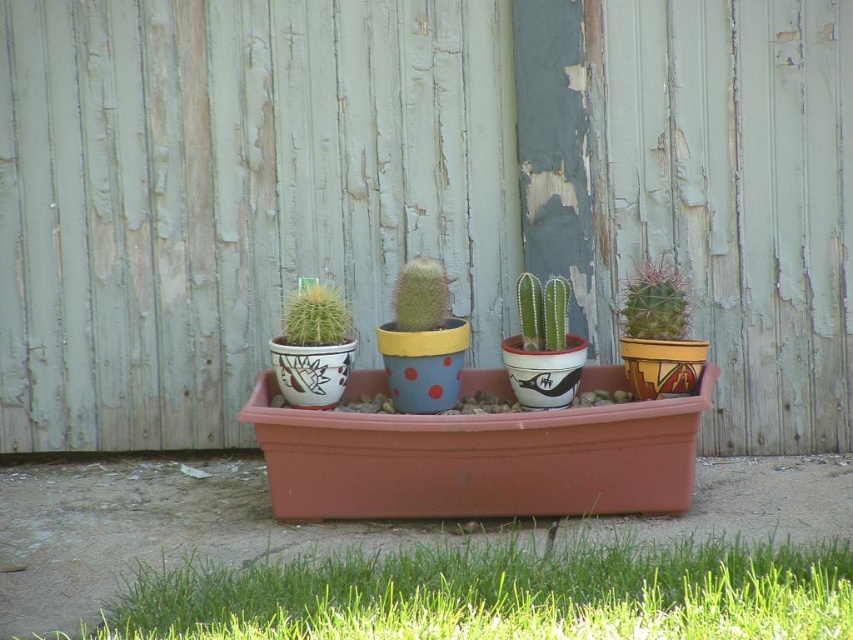
Which is behind, point (219, 630) or point (532, 282)?

Point (532, 282)

This screenshot has width=853, height=640. I want to click on green matte cactus at lower center, so click(498, 593).

Between sandy brown textured cactus at center and matte ceramic cactus at center, which one has more height?

sandy brown textured cactus at center is taller.

Does point (674, 296) come in front of point (325, 284)?

Yes, point (674, 296) is closer to viewer.

Who is more forward, (624,285) or (350,332)?

Positioned in front is point (350,332).

Identify the location of sandy brown textured cactus at center. (654, 301).

Is point (267, 627) farther from camera compared to point (656, 276)?

No, it is not.

Can you confirm if green matte cactus at lower center is positioned above sandy brown textured cactus at center?

Incorrect, green matte cactus at lower center is not positioned above sandy brown textured cactus at center.

What do you see at coordinates (498, 593) in the screenshot? I see `green matte cactus at lower center` at bounding box center [498, 593].

Identify the location of green matte cactus at lower center. The image size is (853, 640). (498, 593).